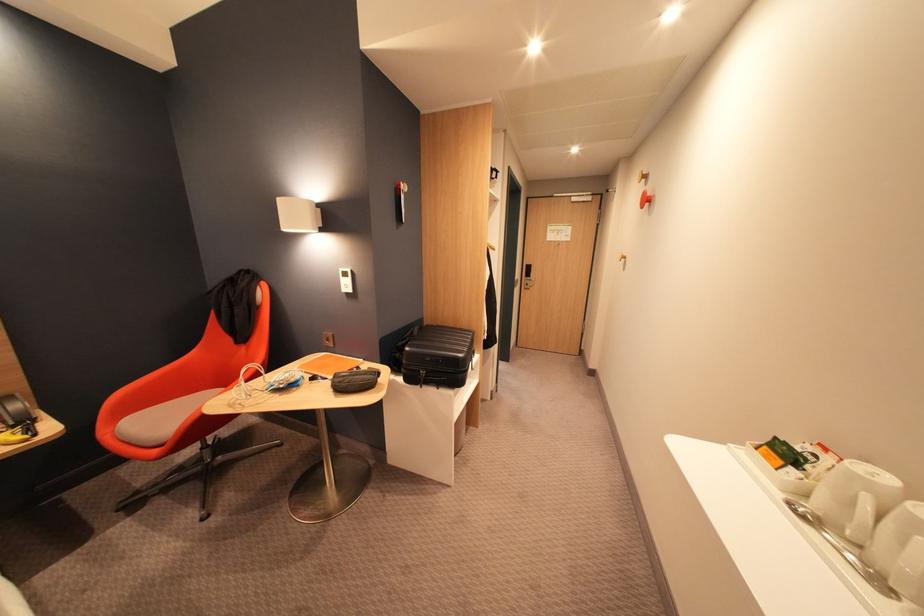
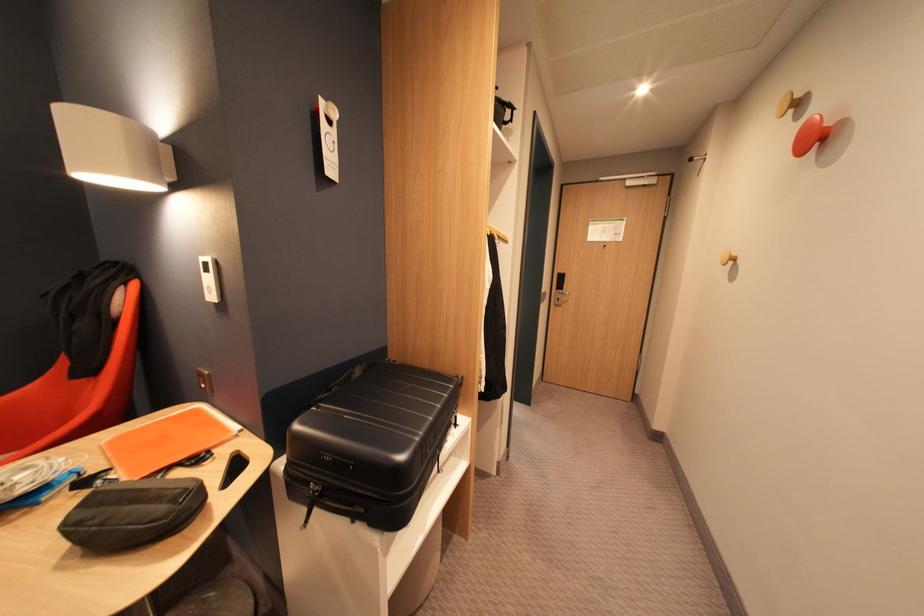
Find the pixel in the second image that matches point 527,278 in the first image.

(555, 290)